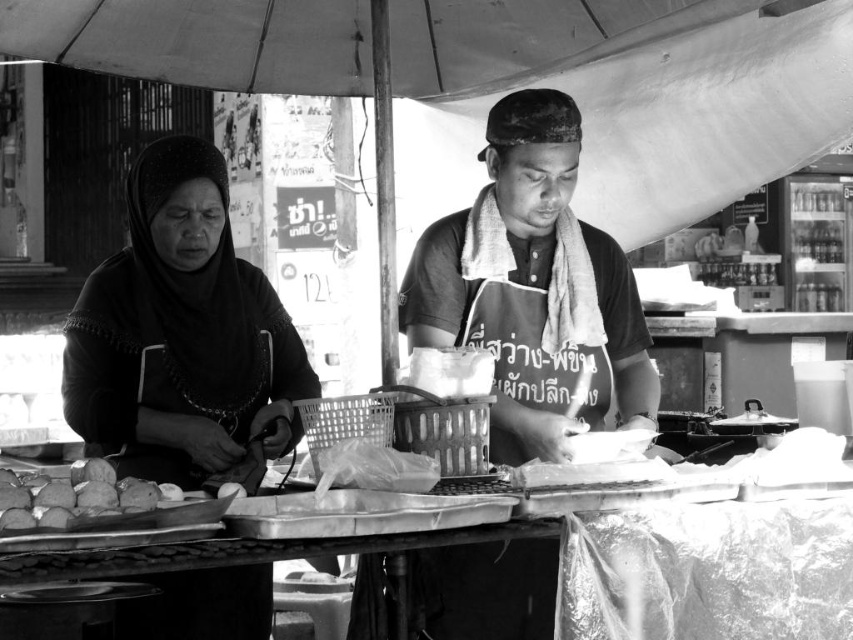
Based on the photo, you are a customer standing in front of the street food stall. You want to grab a snack from the metallic tray at center. Is the tray within your reach?

The metallic tray at center is 5.54 meters from camera, so it is too far to reach. Please ask the vendor for assistance.